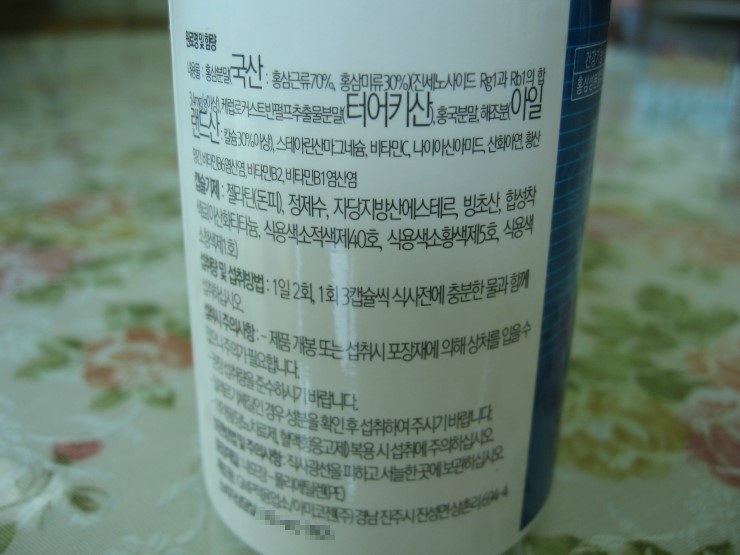
Find the location of a particular element. The image size is (740, 555). light reflection on countertop is located at coordinates (682, 98), (719, 129), (645, 102).